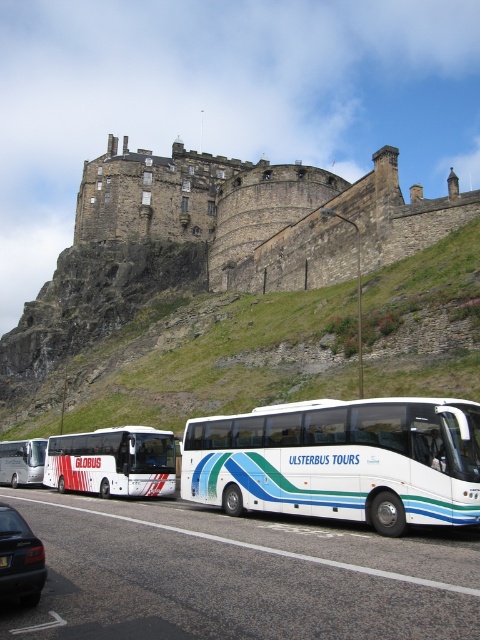
Question: Which point is closer to the camera taking this photo?

Choices:
 (A) (228, 541)
 (B) (197, 474)

Answer: (A)

Question: Does white glossy bus at lower center have a larger size compared to white glossy bus at lower left?

Choices:
 (A) no
 (B) yes

Answer: (B)

Question: Is white glossy bus at lower center positioned behind white glossy bus at left?

Choices:
 (A) no
 (B) yes

Answer: (A)

Question: Among these points, which one is farthest from the camera?

Choices:
 (A) (13, 582)
 (B) (444, 582)

Answer: (B)

Question: Can you confirm if brown stone castle at upper center is wider than black rubber car at lower left?

Choices:
 (A) yes
 (B) no

Answer: (A)

Question: Which point is closer to the camera?

Choices:
 (A) shiny black sedan at lower left
 (B) white glossy bus at lower center
 (C) brown stone castle at upper center
 (D) white glossy bus at lower left

Answer: (A)